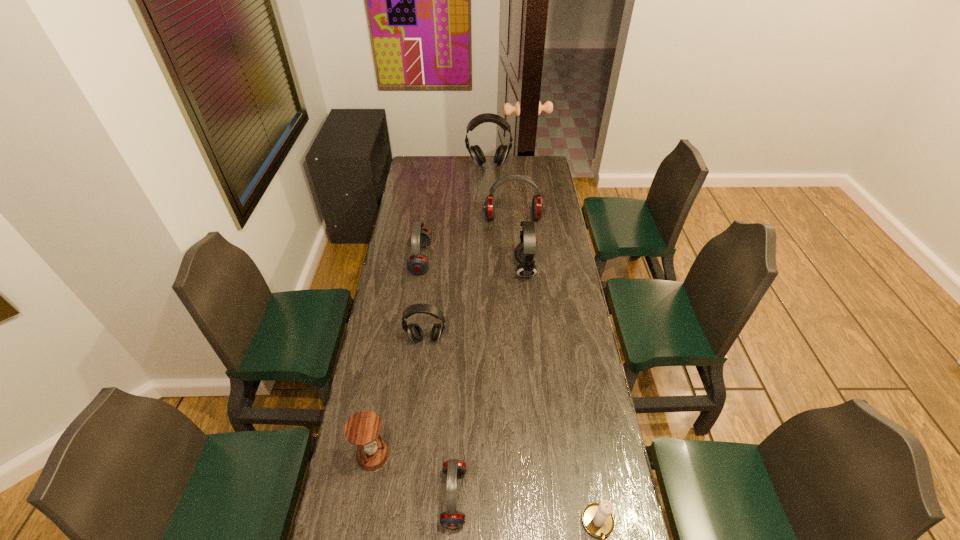
You are a GUI agent. You are given a task and a screenshot of the screen. Output one action in this format:
    pyautogui.click(x=<x>, y=<y>)
    Task: Click on the free space between the rightmost red earphone and the nearest earphone
    Image resolution: width=960 pixels, height=540 pixels.
    Given the screenshot: What is the action you would take?
    point(484,357)

At what (x,y) coordinates should I click in order to perform the action: click on vacant region between the second smallest black earphone and the second nearest red earphone. Please return your answer as a coordinate pair (x, y). The width and height of the screenshot is (960, 540). Looking at the image, I should click on (473, 264).

You are a GUI agent. You are given a task and a screenshot of the screen. Output one action in this format:
    pyautogui.click(x=<x>, y=<y>)
    Task: Click on the vacant area between the nearest black earphone and the second farthest black earphone
    The width and height of the screenshot is (960, 540).
    Given the screenshot: What is the action you would take?
    click(475, 304)

Find the location of a particular element. The height and width of the screenshot is (540, 960). unoccupied position between the second nearest red earphone and the nearest earphone is located at coordinates (438, 379).

Point out which object is positioned as the second nearest to the hourglass. Please provide its 2D coordinates. Your answer should be formatted as a tuple, i.e. [(x, y)], where the tuple contains the x and y coordinates of a point satisfying the conditions above.

[(415, 332)]

Identify which object is located as the fifth nearest to the tallest object. Please provide its 2D coordinates. Your answer should be formatted as a tuple, i.e. [(x, y)], where the tuple contains the x and y coordinates of a point satisfying the conditions above.

[(362, 429)]

At what (x,y) coordinates should I click in order to perform the action: click on the fifth closest earphone to the hourglass. Please return your answer as a coordinate pair (x, y). Looking at the image, I should click on (538, 207).

At what (x,y) coordinates should I click in order to perform the action: click on earphone that can be found as the closest to the nearest red earphone. Please return your answer as a coordinate pair (x, y). Looking at the image, I should click on (415, 332).

Locate which black earphone ranks second in proximity to the second farthest black earphone. Please provide its 2D coordinates. Your answer should be formatted as a tuple, i.e. [(x, y)], where the tuple contains the x and y coordinates of a point satisfying the conditions above.

[(476, 153)]

Where is `black earphone that stands as the second closest to the smallest red earphone`? black earphone that stands as the second closest to the smallest red earphone is located at coordinates (525, 251).